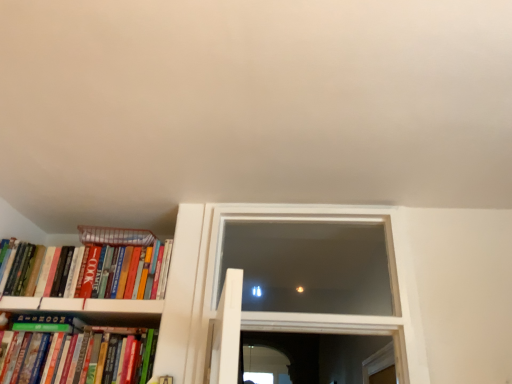
Question: Considering the relative sizes of hardcover books at left, positioned as the 1th book in top-to-bottom order, and green matte bookshelf at lower left, arranged as the 1th book when ordered from the bottom, in the image provided, is hardcover books at left, positioned as the 1th book in top-to-bottom order, thinner than green matte bookshelf at lower left, arranged as the 1th book when ordered from the bottom,?

Choices:
 (A) yes
 (B) no

Answer: (B)

Question: From a real-world perspective, is hardcover books at left, acting as the second book starting from the bottom, on green matte bookshelf at lower left, marked as the second book in a top-to-bottom arrangement?

Choices:
 (A) yes
 (B) no

Answer: (A)

Question: Is hardcover books at left, positioned as the 1th book in top-to-bottom order, not within green matte bookshelf at lower left, marked as the second book in a top-to-bottom arrangement?

Choices:
 (A) yes
 (B) no

Answer: (A)

Question: Is hardcover books at left, positioned as the 1th book in top-to-bottom order, shorter than green matte bookshelf at lower left, arranged as the 1th book when ordered from the bottom?

Choices:
 (A) yes
 (B) no

Answer: (A)

Question: Is hardcover books at left, positioned as the 1th book in top-to-bottom order, with green matte bookshelf at lower left, arranged as the 1th book when ordered from the bottom?

Choices:
 (A) yes
 (B) no

Answer: (B)

Question: Looking at their shapes, would you say transparent glass window at center is wider or thinner than green matte bookshelf at lower left, marked as the second book in a top-to-bottom arrangement?

Choices:
 (A) wide
 (B) thin

Answer: (B)

Question: Considering the relative positions of transparent glass window at center and green matte bookshelf at lower left, arranged as the 1th book when ordered from the bottom, in the image provided, is transparent glass window at center to the left or to the right of green matte bookshelf at lower left, arranged as the 1th book when ordered from the bottom,?

Choices:
 (A) left
 (B) right

Answer: (B)

Question: From their relative heights in the image, would you say transparent glass window at center is taller or shorter than green matte bookshelf at lower left, marked as the second book in a top-to-bottom arrangement?

Choices:
 (A) short
 (B) tall

Answer: (B)

Question: From the image's perspective, is transparent glass window at center positioned above or below green matte bookshelf at lower left, marked as the second book in a top-to-bottom arrangement?

Choices:
 (A) below
 (B) above

Answer: (B)

Question: Is point (34, 349) closer or farther from the camera than point (397, 284)?

Choices:
 (A) closer
 (B) farther

Answer: (B)

Question: Visually, is green matte bookshelf at lower left, arranged as the 1th book when ordered from the bottom, positioned to the left or to the right of transparent glass window at center?

Choices:
 (A) left
 (B) right

Answer: (A)

Question: Is green matte bookshelf at lower left, arranged as the 1th book when ordered from the bottom, in front of or behind transparent glass window at center in the image?

Choices:
 (A) front
 (B) behind

Answer: (A)

Question: Based on their sizes in the image, would you say green matte bookshelf at lower left, arranged as the 1th book when ordered from the bottom, is bigger or smaller than transparent glass window at center?

Choices:
 (A) small
 (B) big

Answer: (A)

Question: Visually, is hardcover books at left, positioned as the 1th book in top-to-bottom order, positioned to the left or to the right of striped paper at left?

Choices:
 (A) right
 (B) left

Answer: (B)

Question: Is hardcover books at left, acting as the second book starting from the bottom, taller or shorter than striped paper at left?

Choices:
 (A) tall
 (B) short

Answer: (A)